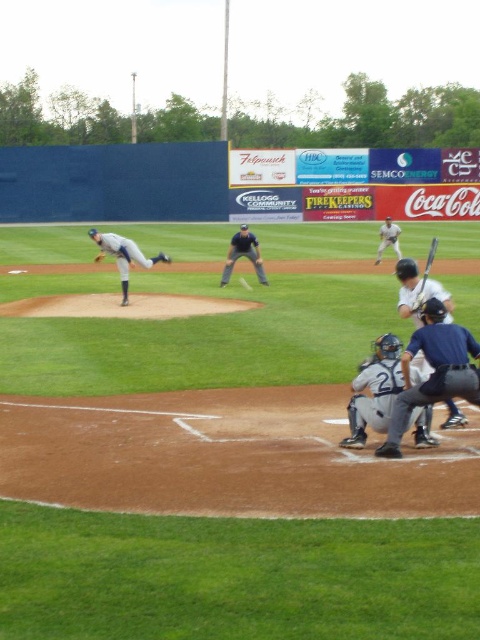
Is white matte catcher at center wider than wooden baseball bat at lower right?

In fact, white matte catcher at center might be narrower than wooden baseball bat at lower right.

Is white matte catcher at center smaller than wooden baseball bat at lower right?

Correct, white matte catcher at center occupies less space than wooden baseball bat at lower right.

Where is `white matte catcher at center`? white matte catcher at center is located at coordinates (374, 390).

Does white matte baseball bat at upper right appear under brown leather glove at center?

Incorrect, white matte baseball bat at upper right is not positioned below brown leather glove at center.

Does white matte baseball bat at upper right lie in front of brown leather glove at center?

That is False.

This screenshot has height=640, width=480. I want to click on white matte baseball bat at upper right, so pyautogui.click(x=388, y=237).

Can you confirm if dark blue uniform at lower right is wider than white matte catcher at center?

Yes, dark blue uniform at lower right is wider than white matte catcher at center.

Is point (407, 368) farther from viewer compared to point (349, 417)?

That is False.

Locate an element on the screen. The image size is (480, 640). dark blue uniform at lower right is located at coordinates pyautogui.click(x=433, y=371).